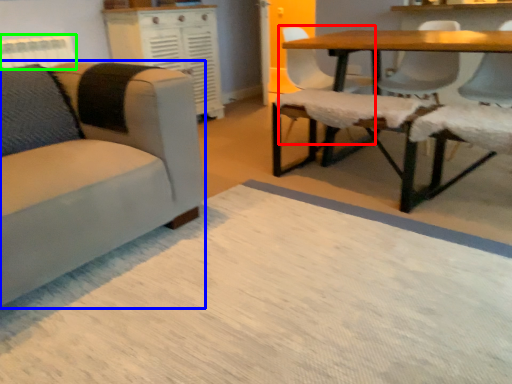
Question: Based on their relative distances, which object is farther from chair (highlighted by a red box)? Choose from chair (highlighted by a blue box) and radiator (highlighted by a green box).

Choices:
 (A) chair
 (B) radiator

Answer: (B)